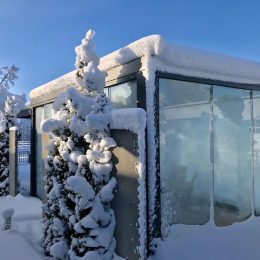
I want to click on glass, so click(203, 160).